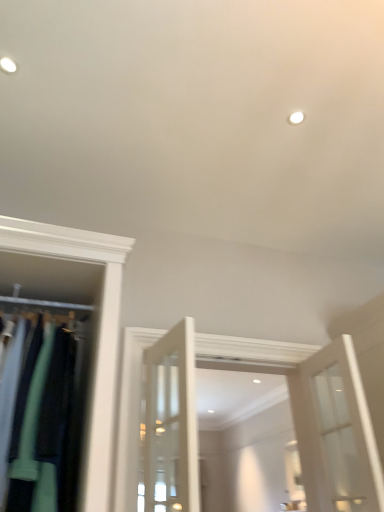
Question: From the image's perspective, would you say matte green fabric at left is shown under white glass door at right?

Choices:
 (A) yes
 (B) no

Answer: (B)

Question: From a real-world perspective, is matte green fabric at left positioned over white glass door at right based on gravity?

Choices:
 (A) no
 (B) yes

Answer: (B)

Question: Is matte green fabric at left wider than white glass door at right?

Choices:
 (A) no
 (B) yes

Answer: (B)

Question: From the image's perspective, is matte green fabric at left on top of white glass door at right?

Choices:
 (A) no
 (B) yes

Answer: (B)

Question: Is matte green fabric at left looking in the opposite direction of white glass door at right?

Choices:
 (A) no
 (B) yes

Answer: (A)

Question: Is the position of matte green fabric at left more distant than that of white glass door at right?

Choices:
 (A) yes
 (B) no

Answer: (B)

Question: Is white glass door at right wider than matte green fabric at left?

Choices:
 (A) no
 (B) yes

Answer: (A)

Question: From the image's perspective, is white glass door at right under matte green fabric at left?

Choices:
 (A) no
 (B) yes

Answer: (B)

Question: Is white glass door at right smaller than matte green fabric at left?

Choices:
 (A) yes
 (B) no

Answer: (A)

Question: Is white glass door at right taller than matte green fabric at left?

Choices:
 (A) yes
 (B) no

Answer: (B)

Question: Is white glass door at right to the right of matte green fabric at left from the viewer's perspective?

Choices:
 (A) no
 (B) yes

Answer: (B)

Question: Is white glass door at right placed right next to matte green fabric at left?

Choices:
 (A) yes
 (B) no

Answer: (B)

Question: Which is correct: matte green fabric at left is inside white glass door at right, or outside of it?

Choices:
 (A) inside
 (B) outside

Answer: (B)